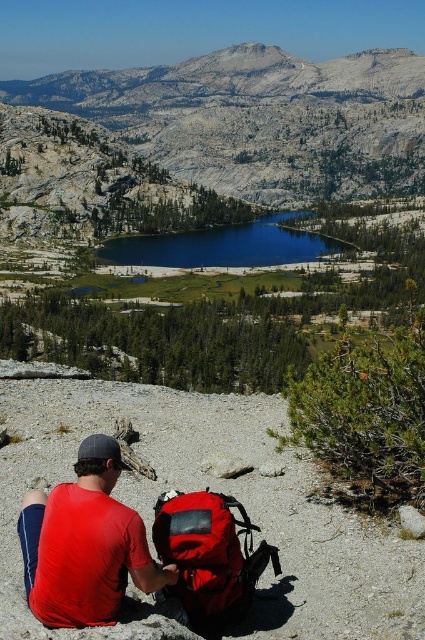
You are standing at the vantage point looking at the gray rocky mountain at upper center and the blue reflective water at center. Which object is located to the right of the other?

The gray rocky mountain at upper center is positioned on the right side of blue reflective water at center.

Consider the image. You are a photographer planning to take a photo of the red matte shirt at lower left and the matte red backpack at lower center. To ensure both are visible in the frame, should you adjust your camera to focus on the foreground or background?

The red matte shirt at lower left is in front of the matte red backpack at lower center. To ensure both are visible in the frame, focus on the foreground since the red matte shirt at lower left is closer to the camera than the matte red backpack at lower center.